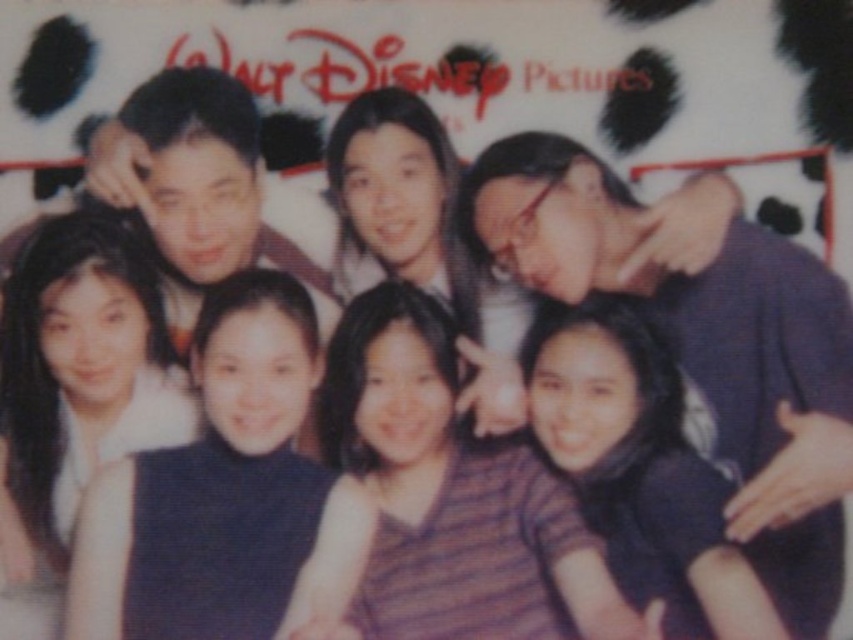
Does smooth black dress at lower left come in front of striped fabric shirt at lower center?

No, smooth black dress at lower left is further to the viewer.

Does smooth black dress at lower left have a greater height compared to striped fabric shirt at lower center?

Correct, smooth black dress at lower left is much taller as striped fabric shirt at lower center.

This screenshot has width=853, height=640. Identify the location of smooth black dress at lower left. (78, 378).

What do you see at coordinates (254, 364) in the screenshot?
I see `dark blue dress at center` at bounding box center [254, 364].

I want to click on dark blue dress at center, so click(254, 364).

What are the coordinates of `dark blue dress at center` in the screenshot? It's located at tap(254, 364).

Is matte black man at center taller than dark blue dress at center?

No.

Where is `matte black man at center`? matte black man at center is located at coordinates (198, 186).

Is point (131, 148) more distant than point (100, 490)?

Yes, it is behind point (100, 490).

Image resolution: width=853 pixels, height=640 pixels. In order to click on matte black man at center in this screenshot , I will do `click(198, 186)`.